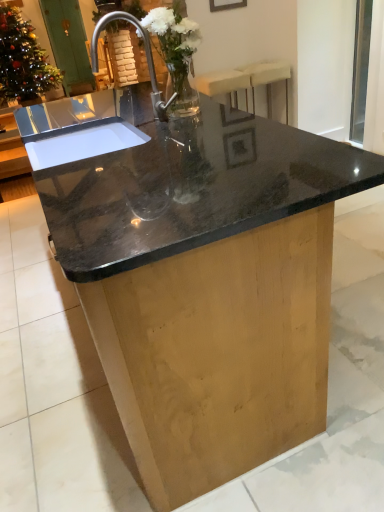
Where is `free space in front of clear glass vase at center, which is counted as the first floral arrangement, starting from the bottom`? The width and height of the screenshot is (384, 512). free space in front of clear glass vase at center, which is counted as the first floral arrangement, starting from the bottom is located at coordinates (195, 125).